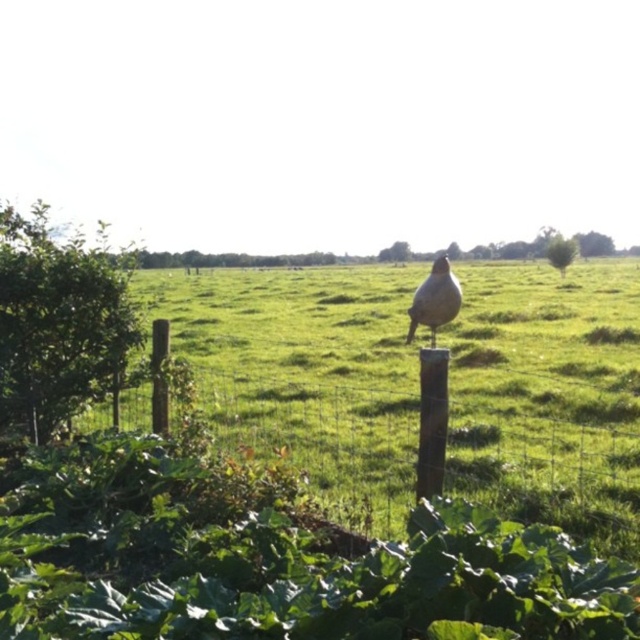
From the picture: You are standing in front of the wire fence and see the brown wooden post at center and the brown speckled bird at center. Which object is located to the right?

The brown speckled bird at center is located to the right of the brown wooden post at center.

You are a painter standing at the edge of the field, looking at the brown wooden post at center and the brown speckled bird at center. Which object is wider?

The brown wooden post at center is wider than the brown speckled bird at center according to the description.

You are standing at the origin point in the image. There are two points marked as point 1 at coordinates point (497,429) and point 2 at coordinates point (460,298). Which point is closer to you?

Point 2 at coordinates point (460,298) is closer to you because it is in front of point 1 at coordinates point (497,429).